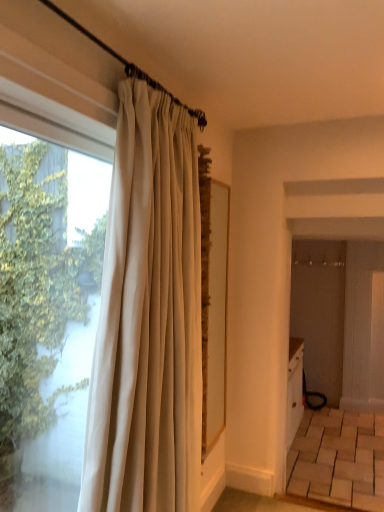
The height and width of the screenshot is (512, 384). What do you see at coordinates (47, 313) in the screenshot? I see `transparent glass window at left` at bounding box center [47, 313].

Where is `transparent glass window at left`? The width and height of the screenshot is (384, 512). transparent glass window at left is located at coordinates (47, 313).

Describe the element at coordinates (148, 318) in the screenshot. I see `white silk curtain at left` at that location.

The image size is (384, 512). I want to click on white silk curtain at left, so click(x=148, y=318).

Measure the distance between white silk curtain at left and camera.

white silk curtain at left and camera are 1.50 meters apart from each other.

The width and height of the screenshot is (384, 512). In order to click on transparent glass window at left in this screenshot , I will do `click(47, 313)`.

In the image, is white silk curtain at left on the left side or the right side of transparent glass window at left?

Clearly, white silk curtain at left is on the right of transparent glass window at left in the image.

Who is more distant, white silk curtain at left or transparent glass window at left?

white silk curtain at left.

Which point is more forward, (146, 120) or (66, 361)?

The point (146, 120) is more forward.

From the image's perspective, is white silk curtain at left on transparent glass window at left?

No, from the image's perspective, white silk curtain at left is not above transparent glass window at left.

From a real-world perspective, which is physically above, white silk curtain at left or transparent glass window at left?

transparent glass window at left is physically above.

Can you confirm if white silk curtain at left is wider than transparent glass window at left?

Correct, the width of white silk curtain at left exceeds that of transparent glass window at left.

Is white silk curtain at left taller than transparent glass window at left?

Yes, white silk curtain at left is taller than transparent glass window at left.

Considering the sizes of white silk curtain at left and transparent glass window at left in the image, is white silk curtain at left bigger or smaller than transparent glass window at left?

Considering their sizes, white silk curtain at left takes up more space than transparent glass window at left.

Which is correct: white silk curtain at left is inside transparent glass window at left, or outside of it?

white silk curtain at left exists outside the volume of transparent glass window at left.

Is white silk curtain at left far from transparent glass window at left?

No, there isn't a large distance between white silk curtain at left and transparent glass window at left.

Is white silk curtain at left aimed at transparent glass window at left?

No.

At what (x,y) coordinates should I click in order to perform the action: click on curtain below the transparent glass window at left (from the image's perspective). Please return your answer as a coordinate pair (x, y). Looking at the image, I should click on (148, 318).

Is transparent glass window at left at the left side of white silk curtain at left?

Indeed, transparent glass window at left is positioned on the left side of white silk curtain at left.

Is transparent glass window at left further to camera compared to white silk curtain at left?

No, transparent glass window at left is closer to the viewer.

Which is behind, point (12, 358) or point (175, 187)?

The point (12, 358) is farther from the camera.

From the image's perspective, which one is positioned lower, transparent glass window at left or white silk curtain at left?

From the image's view, white silk curtain at left is below.

From a real-world perspective, is transparent glass window at left below white silk curtain at left?

No, from a real-world perspective, transparent glass window at left is not beneath white silk curtain at left.

Considering the relative sizes of transparent glass window at left and white silk curtain at left in the image provided, is transparent glass window at left thinner than white silk curtain at left?

Correct, the width of transparent glass window at left is less than that of white silk curtain at left.

From their relative heights in the image, would you say transparent glass window at left is taller or shorter than white silk curtain at left?

transparent glass window at left is shorter than white silk curtain at left.

Considering the relative sizes of transparent glass window at left and white silk curtain at left in the image provided, is transparent glass window at left bigger than white silk curtain at left?

No, transparent glass window at left is not bigger than white silk curtain at left.

Is white silk curtain at left completely or partially inside transparent glass window at left?

No.

Is transparent glass window at left next to white silk curtain at left and touching it?

No, transparent glass window at left is not with white silk curtain at left.

Could you tell me if transparent glass window at left is facing white silk curtain at left?

Yes, transparent glass window at left faces towards white silk curtain at left.

How different are the orientations of transparent glass window at left and white silk curtain at left in degrees?

2.74 degrees.

Measure the distance between transparent glass window at left and white silk curtain at left.

They are 13.02 inches apart.

At what (x,y) coordinates should I click in order to perform the action: click on window in front of the white silk curtain at left. Please return your answer as a coordinate pair (x, y). The width and height of the screenshot is (384, 512). Looking at the image, I should click on pyautogui.click(x=47, y=313).

This screenshot has height=512, width=384. I want to click on window on the left of white silk curtain at left, so click(x=47, y=313).

This screenshot has height=512, width=384. What are the coordinates of `curtain behind the transparent glass window at left` in the screenshot? It's located at (148, 318).